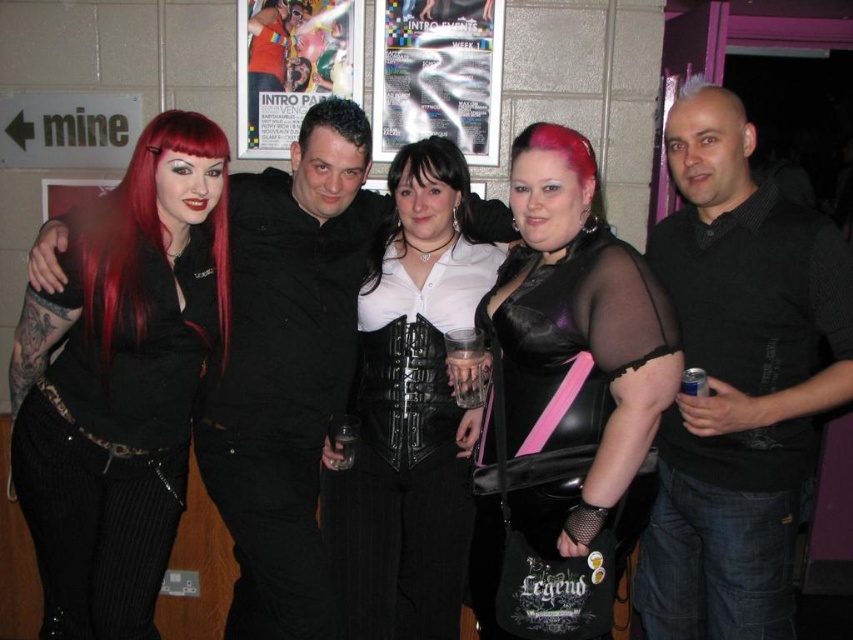
Which is more to the right, matte black top at left or black leather corset at center?

black leather corset at center is more to the right.

Does matte black top at left have a greater height compared to black leather corset at center?

No, matte black top at left is not taller than black leather corset at center.

Between point (187, 264) and point (404, 476), which one is positioned in front?

Point (187, 264) is in front.

Find the location of `matte black top at left`. matte black top at left is located at coordinates (120, 381).

Is black leather corset at center shorter than metallic silver poster at upper center?

Incorrect, black leather corset at center's height does not fall short of metallic silver poster at upper center's.

Which is in front, point (341, 500) or point (482, 49)?

Point (341, 500) is in front.

Locate an element on the screen. The height and width of the screenshot is (640, 853). black leather corset at center is located at coordinates (410, 410).

Is black matte shirt at center bigger than metallic silver poster at upper center?

Yes, black matte shirt at center is bigger than metallic silver poster at upper center.

Between black matte shirt at center and metallic silver poster at upper center, which one is positioned lower?

Positioned lower is black matte shirt at center.

Is point (248, 284) positioned after point (416, 22)?

No, (248, 284) is in front of (416, 22).

The height and width of the screenshot is (640, 853). Identify the location of black matte shirt at center. (288, 365).